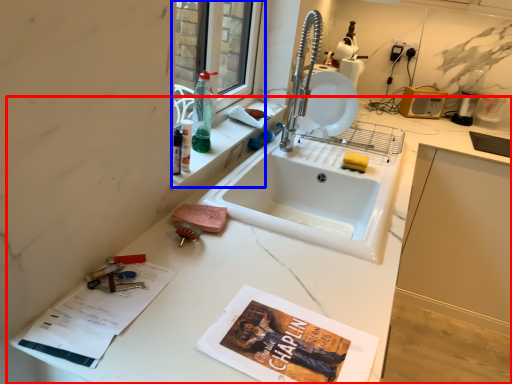
Question: Which object appears closest to the camera in this image, countertop (highlighted by a red box) or window (highlighted by a blue box)?

Choices:
 (A) countertop
 (B) window

Answer: (A)